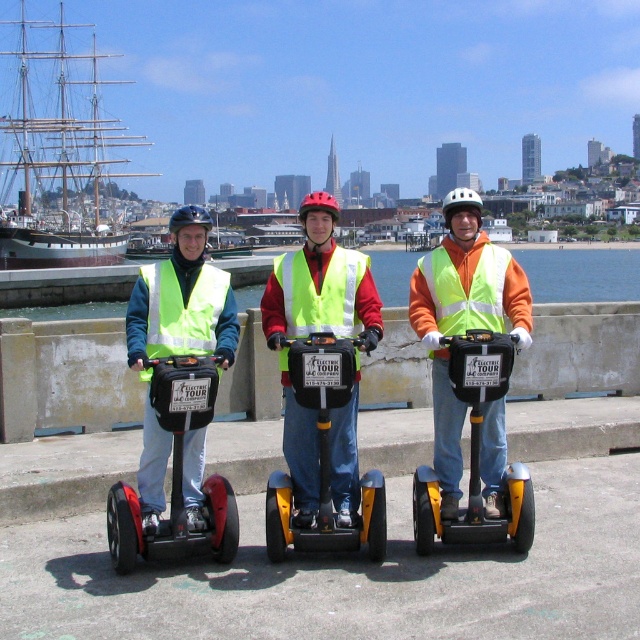
Question: Does white wooden ship at upper left appear under yellow matte scooter at center?

Choices:
 (A) no
 (B) yes

Answer: (A)

Question: Which object appears farthest from the camera in this image?

Choices:
 (A) hi-visibility reflective safety vest at center
 (B) yellow matte segway at center
 (C) black rubber scooter at center
 (D) white wooden ship at upper left

Answer: (D)

Question: Among these points, which one is farthest from the camera?

Choices:
 (A) (484, 352)
 (B) (198, 321)
 (C) (70, 218)
 (D) (550, 289)

Answer: (C)

Question: Is matte yellow vest at center positioned behind hi-visibility reflective safety vest at center?

Choices:
 (A) yes
 (B) no

Answer: (B)

Question: Can you confirm if white wooden ship at upper left is positioned below hi-visibility reflective safety vest at center?

Choices:
 (A) yes
 (B) no

Answer: (B)

Question: Which is farther from the yellow matte scooter at center?

Choices:
 (A) blue water at center
 (B) white wooden ship at upper left

Answer: (B)